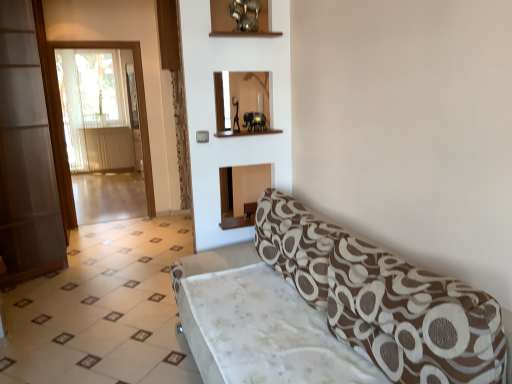
Identify the location of free point to the right of transparent glass screen door at left, placed as the second screen door when sorted from back to front. (122, 253).